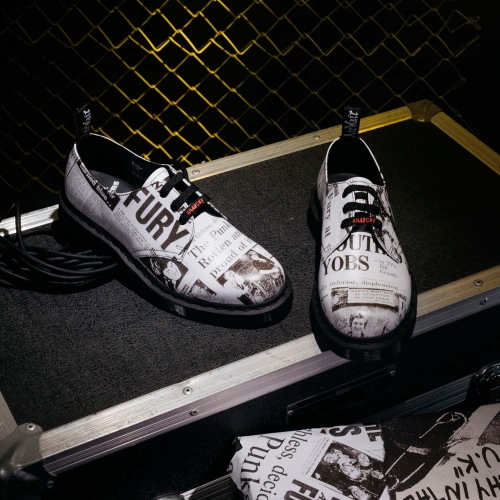
The image size is (500, 500). I want to click on newspaper, so click(x=289, y=455).